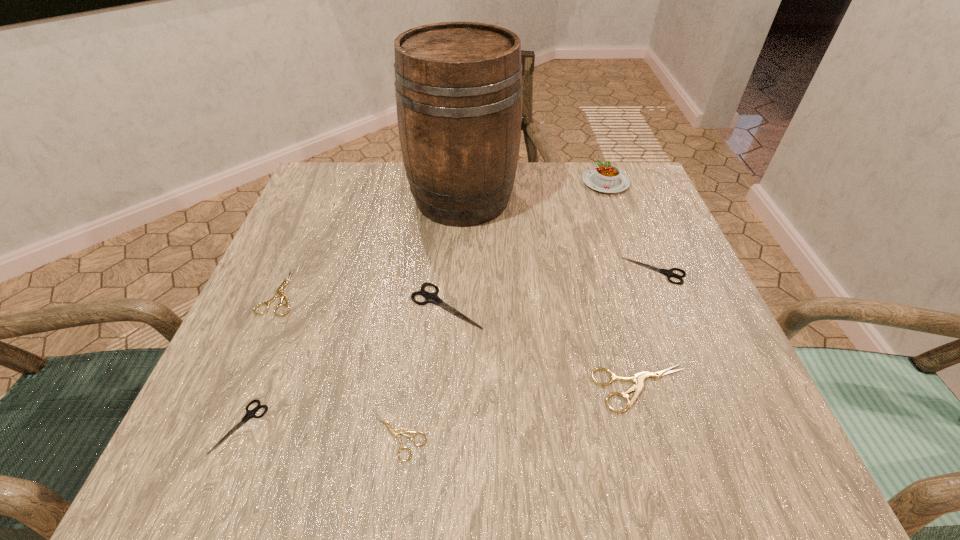
Where is `free space at the far left corner of the desktop`? This screenshot has height=540, width=960. free space at the far left corner of the desktop is located at coordinates (324, 172).

At what (x,y) coordinates should I click in order to perform the action: click on vacant space at the near left corner of the desktop. Please return your answer as a coordinate pair (x, y). The height and width of the screenshot is (540, 960). Looking at the image, I should click on (259, 421).

The width and height of the screenshot is (960, 540). In the image, there is a desktop. Find the location of `vacant space at the far right corner`. vacant space at the far right corner is located at coordinates (660, 212).

The width and height of the screenshot is (960, 540). What are the coordinates of `free space between the rightmost black shears and the farthest beige shears` in the screenshot? It's located at (468, 281).

This screenshot has width=960, height=540. I want to click on free point between the shortest shears and the nearest black shears, so click(320, 431).

Where is `empty space that is in between the shortest shears and the cider`? Image resolution: width=960 pixels, height=540 pixels. empty space that is in between the shortest shears and the cider is located at coordinates (431, 318).

You are a GUI agent. You are given a task and a screenshot of the screen. Output one action in this format:
    pyautogui.click(x=<x>, y=<y>)
    Task: Click on the vacant space that's between the cider and the sixth shortest object
    
    Given the screenshot: What is the action you would take?
    pyautogui.click(x=455, y=252)

At what (x,y) coordinates should I click in order to perform the action: click on vacant space that's between the smallest beige shears and the leftmost black shears. Please return your answer as a coordinate pair (x, y). This screenshot has height=540, width=960. Looking at the image, I should click on (320, 431).

Locate an element on the screen. The height and width of the screenshot is (540, 960). empty location between the rightmost beige shears and the farthest beige shears is located at coordinates (461, 340).

Locate an element on the screen. The height and width of the screenshot is (540, 960). free space between the rightmost black shears and the rightmost beige shears is located at coordinates (649, 329).